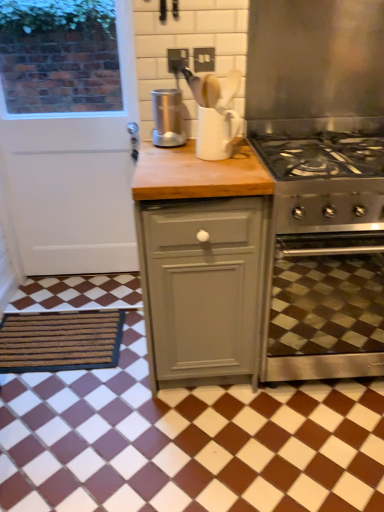
This screenshot has height=512, width=384. In order to click on free space in front of brushed metal canister at upper center in this screenshot , I will do `click(166, 152)`.